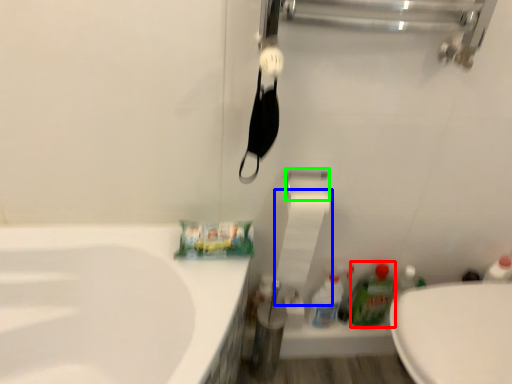
Question: Which object is the closest to the cleaning product (highlighted by a red box)? Choose among these: toilet paper (highlighted by a blue box) or towel bar (highlighted by a green box).

Choices:
 (A) toilet paper
 (B) towel bar

Answer: (A)